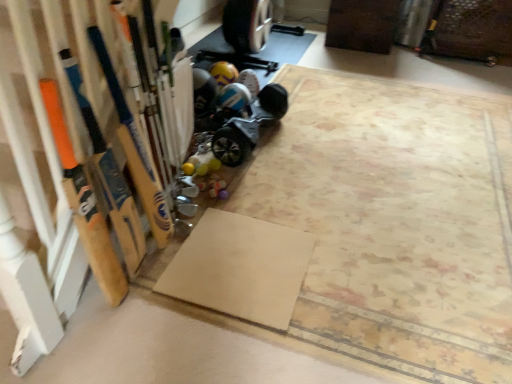
Locate an element on the screen. This screenshot has width=512, height=384. vacant area that is in front of blue metallic hoverboard at lower center is located at coordinates (270, 180).